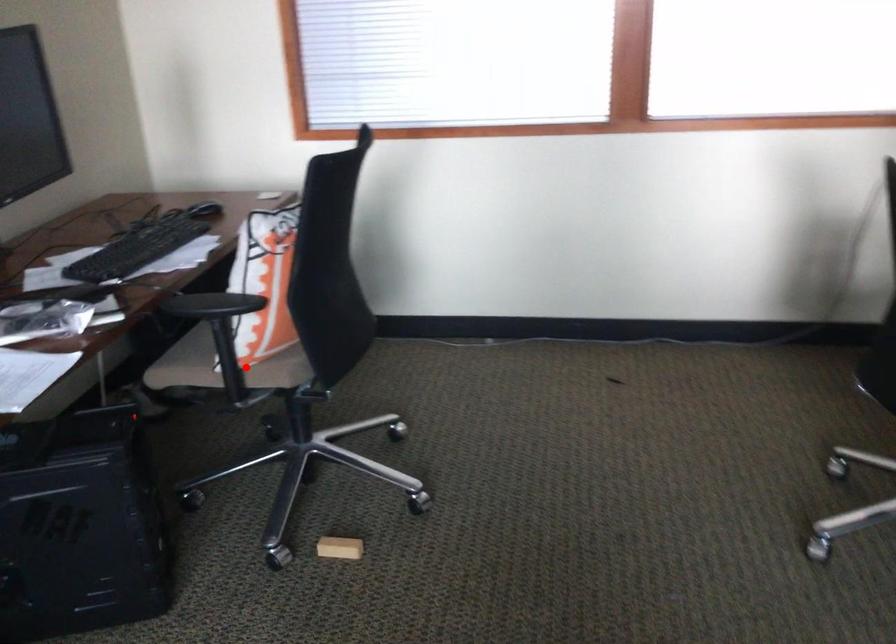
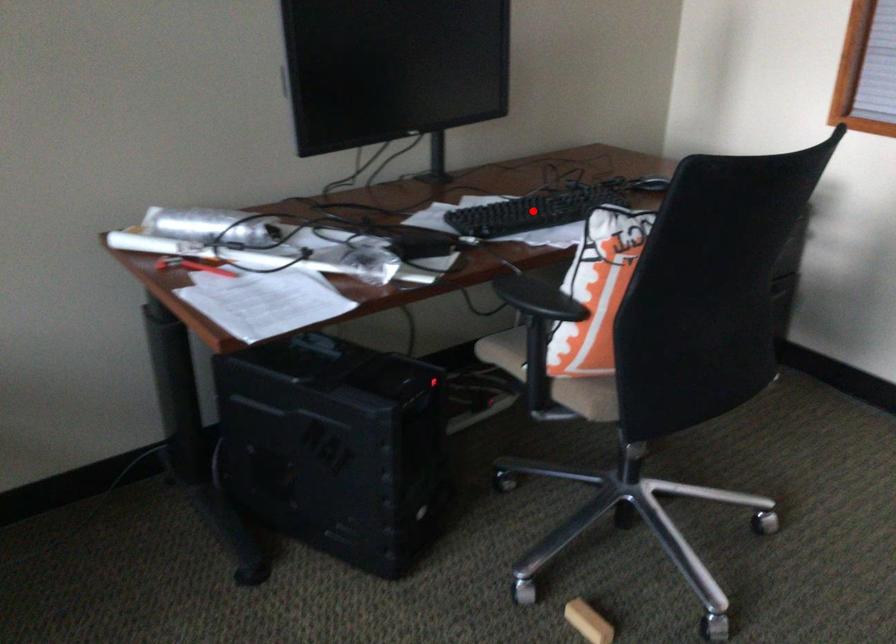
I am providing you with two images of the same scene from different viewpoints. A red point is marked on the first image and another point is marked on the second image. Do the highlighted points in image1 and image2 indicate the same real-world spot?

No